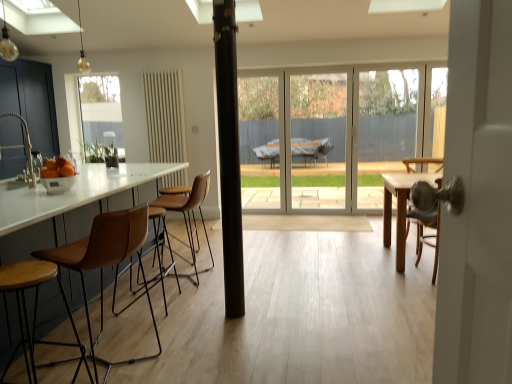
You are a GUI agent. You are given a task and a screenshot of the screen. Output one action in this format:
    pyautogui.click(x=<x>, y=<y>)
    Task: Click on the free space to the left of black matte pole at center
    The width and height of the screenshot is (512, 384).
    Given the screenshot: What is the action you would take?
    pyautogui.click(x=210, y=310)